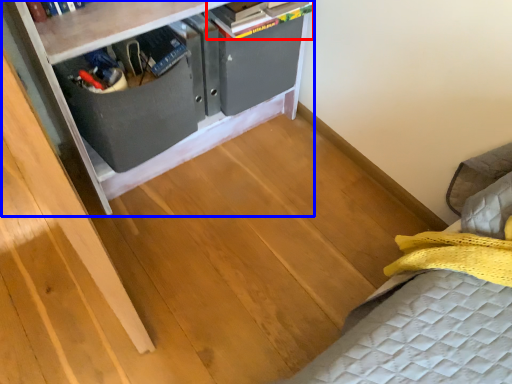
Question: Which point is further to the camera, book (highlighted by a red box) or furniture (highlighted by a blue box)?

Choices:
 (A) book
 (B) furniture

Answer: (A)